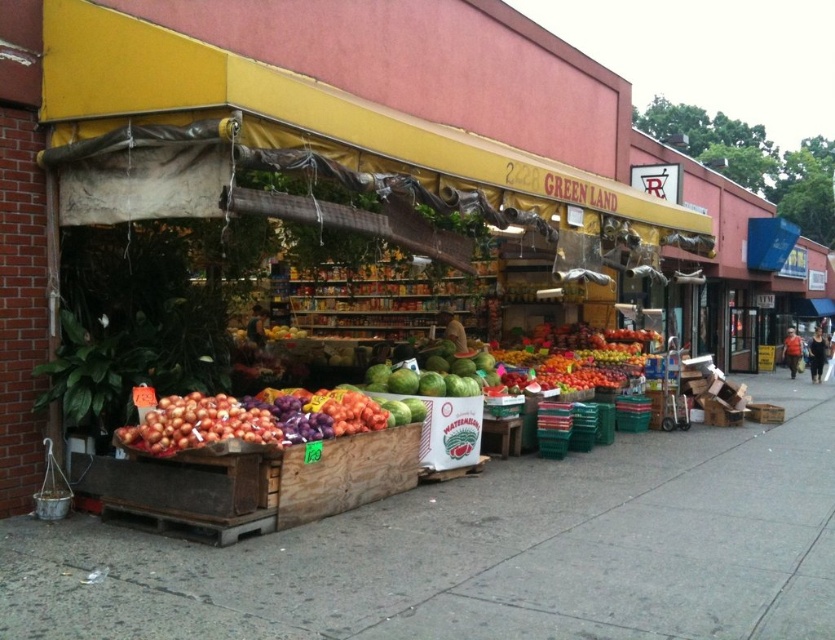
Question: Estimate the real-world distances between objects in this image. Which object is closer to the wooden crates at center?

Choices:
 (A) shiny red apples at center
 (B) shiny brown onions at lower left

Answer: (B)

Question: Estimate the real-world distances between objects in this image. Which object is farther from the shiny brown onions at lower left?

Choices:
 (A) wooden crates at center
 (B) shiny red apples at center

Answer: (B)

Question: Can you confirm if wooden crates at center is positioned to the left of shiny red apples at center?

Choices:
 (A) no
 (B) yes

Answer: (B)

Question: Which object appears closest to the camera in this image?

Choices:
 (A) shiny red apples at center
 (B) shiny brown onions at lower left
 (C) wooden crates at center

Answer: (C)

Question: Is shiny red apples at center thinner than shiny brown onions at lower left?

Choices:
 (A) no
 (B) yes

Answer: (A)

Question: Does wooden crates at center have a lesser width compared to shiny brown onions at lower left?

Choices:
 (A) no
 (B) yes

Answer: (A)